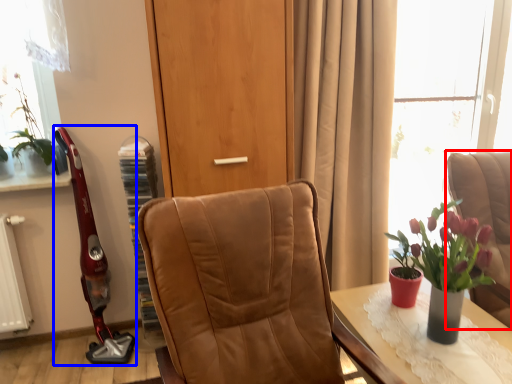
Question: Which of the following is the farthest to the observer, chair (highlighted by a red box) or open (highlighted by a blue box)?

Choices:
 (A) chair
 (B) open

Answer: (B)